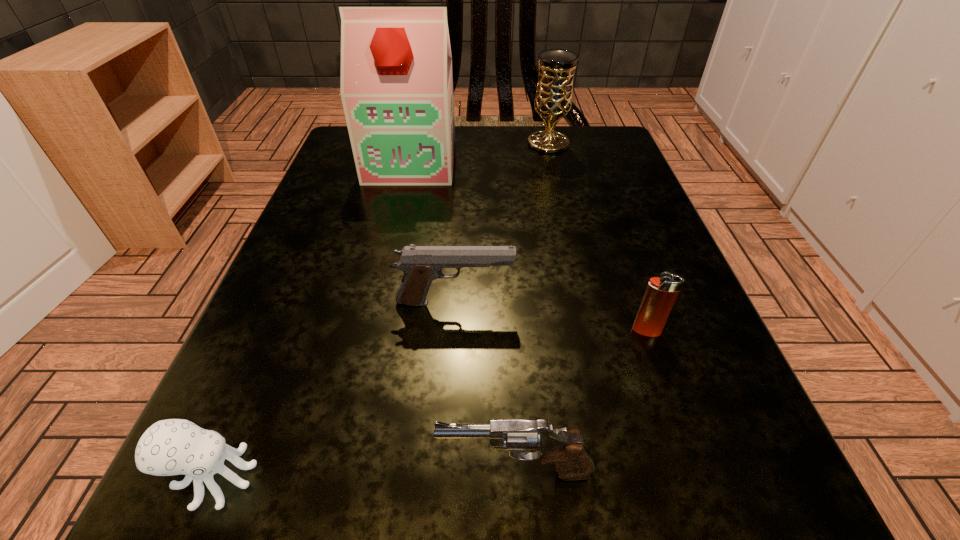
Identify the location of the tallest object. (396, 88).

The height and width of the screenshot is (540, 960). Find the location of `chalice`. chalice is located at coordinates (553, 100).

Image resolution: width=960 pixels, height=540 pixels. I want to click on the farther pistol, so tap(421, 265).

Find the location of a particular element. the fourth farthest object is located at coordinates (661, 292).

You are a GUI agent. You are given a task and a screenshot of the screen. Output one action in this format:
    pyautogui.click(x=<x>, y=<y>)
    Task: Click on the igniter
    
    Given the screenshot: What is the action you would take?
    pyautogui.click(x=661, y=292)

The height and width of the screenshot is (540, 960). Find the location of `the nearer pistol`. the nearer pistol is located at coordinates click(x=572, y=460).

I want to click on octopus, so click(169, 447).

Identify the location of free space located with the cap open on the tallest object. The height and width of the screenshot is (540, 960). (382, 292).

Image resolution: width=960 pixels, height=540 pixels. I want to click on blank space located on the front of the chalice, so [570, 234].

This screenshot has height=540, width=960. What are the coordinates of `vacant area situated at the barrel of the farther pistol` in the screenshot? It's located at [x=587, y=302].